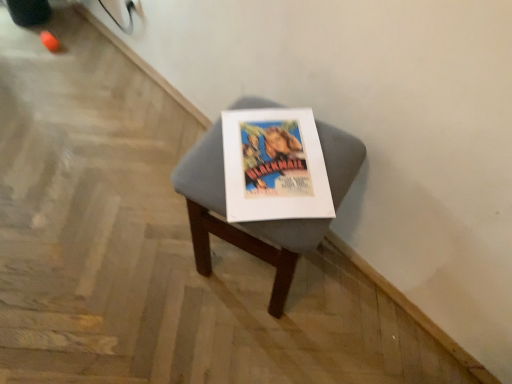
Locate an element on the screen. This screenshot has width=512, height=384. free location to the left of gray fabric stool at center is located at coordinates (149, 257).